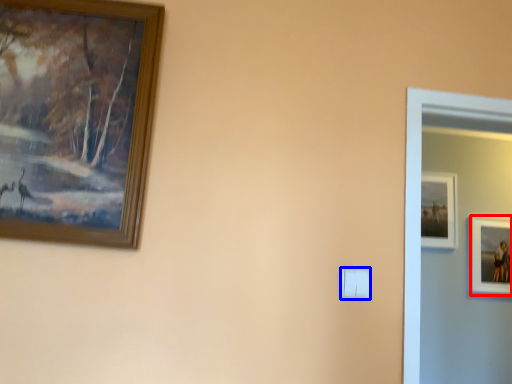
Question: Which object is further to the camera taking this photo, picture frame (highlighted by a red box) or light switch (highlighted by a blue box)?

Choices:
 (A) picture frame
 (B) light switch

Answer: (A)